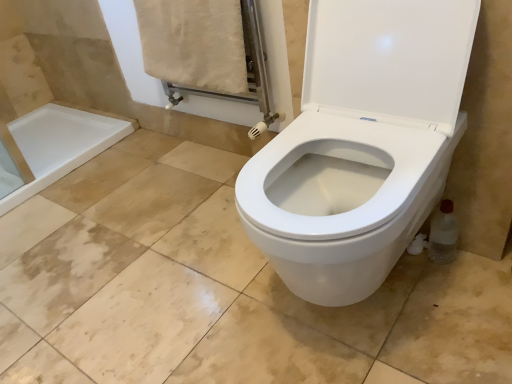
Describe the element at coordinates (443, 234) in the screenshot. I see `clear plastic bottle at lower right` at that location.

The width and height of the screenshot is (512, 384). Find the location of `clear plastic bottle at lower right`. clear plastic bottle at lower right is located at coordinates (443, 234).

The height and width of the screenshot is (384, 512). Describe the element at coordinates (194, 43) in the screenshot. I see `beige cotton towel at upper left` at that location.

Where is `beige cotton towel at upper left`? beige cotton towel at upper left is located at coordinates (194, 43).

Where is `clear plastic bottle at lower right`? Image resolution: width=512 pixels, height=384 pixels. clear plastic bottle at lower right is located at coordinates (443, 234).

Considering the relative positions of beige cotton towel at upper left and clear plastic bottle at lower right in the image provided, is beige cotton towel at upper left to the left of clear plastic bottle at lower right from the viewer's perspective?

Indeed, beige cotton towel at upper left is positioned on the left side of clear plastic bottle at lower right.

Between beige cotton towel at upper left and clear plastic bottle at lower right, which one is positioned in front?

clear plastic bottle at lower right is closer to the camera.

Does point (228, 12) come closer to viewer compared to point (428, 250)?

That is False.

From the image's perspective, is beige cotton towel at upper left located beneath clear plastic bottle at lower right?

No, from the image's perspective, beige cotton towel at upper left is not below clear plastic bottle at lower right.

From the picture: From a real-world perspective, relative to clear plastic bottle at lower right, is beige cotton towel at upper left vertically above or below?

beige cotton towel at upper left is above clear plastic bottle at lower right.

Considering the sizes of objects beige cotton towel at upper left and clear plastic bottle at lower right in the image provided, who is thinner, beige cotton towel at upper left or clear plastic bottle at lower right?

Thinner between the two is clear plastic bottle at lower right.

In terms of height, does beige cotton towel at upper left look taller or shorter compared to clear plastic bottle at lower right?

Considering their sizes, beige cotton towel at upper left has more height than clear plastic bottle at lower right.

Considering the relative sizes of beige cotton towel at upper left and clear plastic bottle at lower right in the image provided, is beige cotton towel at upper left smaller than clear plastic bottle at lower right?

Incorrect, beige cotton towel at upper left is not smaller in size than clear plastic bottle at lower right.

Is beige cotton towel at upper left inside the boundaries of clear plastic bottle at lower right, or outside?

beige cotton towel at upper left exists outside the volume of clear plastic bottle at lower right.

Is beige cotton towel at upper left directly adjacent to clear plastic bottle at lower right?

They are not placed beside each other.

Is beige cotton towel at upper left positioned with its back to clear plastic bottle at lower right?

No, beige cotton towel at upper left is not facing away from clear plastic bottle at lower right.

Identify the location of bottle in front of the beige cotton towel at upper left. This screenshot has height=384, width=512. (443, 234).

Can you confirm if clear plastic bottle at lower right is positioned to the right of beige cotton towel at upper left?

Correct, you'll find clear plastic bottle at lower right to the right of beige cotton towel at upper left.

Is clear plastic bottle at lower right in front of or behind beige cotton towel at upper left in the image?

Visually, clear plastic bottle at lower right is located in front of beige cotton towel at upper left.

Is point (439, 247) behind point (228, 46)?

No, (439, 247) is closer to viewer.

From the image's perspective, is clear plastic bottle at lower right located above beige cotton towel at upper left?

No, from the image's perspective, clear plastic bottle at lower right is not above beige cotton towel at upper left.

From a real-world perspective, is clear plastic bottle at lower right below beige cotton towel at upper left?

Indeed, from a real-world perspective, clear plastic bottle at lower right is positioned beneath beige cotton towel at upper left.

Can you confirm if clear plastic bottle at lower right is wider than beige cotton towel at upper left?

Incorrect, the width of clear plastic bottle at lower right does not surpass that of beige cotton towel at upper left.

Between clear plastic bottle at lower right and beige cotton towel at upper left, which one has less height?

clear plastic bottle at lower right is shorter.

Considering the sizes of objects clear plastic bottle at lower right and beige cotton towel at upper left in the image provided, who is bigger, clear plastic bottle at lower right or beige cotton towel at upper left?

With larger size is beige cotton towel at upper left.

Is clear plastic bottle at lower right not inside beige cotton towel at upper left?

clear plastic bottle at lower right lies outside beige cotton towel at upper left's area.

Is there a large distance between clear plastic bottle at lower right and beige cotton towel at upper left?

clear plastic bottle at lower right is near beige cotton towel at upper left, not far away.

Is clear plastic bottle at lower right oriented towards beige cotton towel at upper left?

No, clear plastic bottle at lower right does not turn towards beige cotton towel at upper left.

Image resolution: width=512 pixels, height=384 pixels. Find the location of `bottle in front of the beige cotton towel at upper left`. bottle in front of the beige cotton towel at upper left is located at coordinates (443, 234).

At what (x,y) coordinates should I click in order to perform the action: click on bottle in front of the beige cotton towel at upper left. Please return your answer as a coordinate pair (x, y). The image size is (512, 384). Looking at the image, I should click on (443, 234).

Locate an element on the screen. bath towel on the left of the clear plastic bottle at lower right is located at coordinates (194, 43).